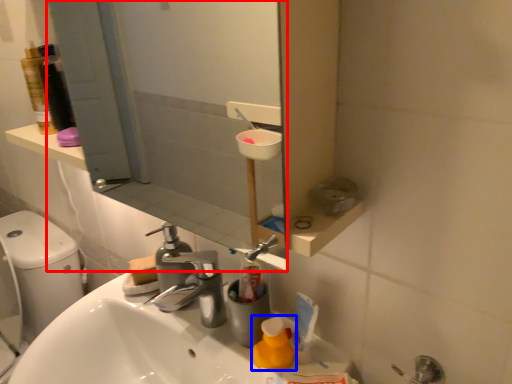
Question: Which object is closer to the camera taking this photo, mirror (highlighted by a red box) or cleaning product (highlighted by a blue box)?

Choices:
 (A) mirror
 (B) cleaning product

Answer: (A)